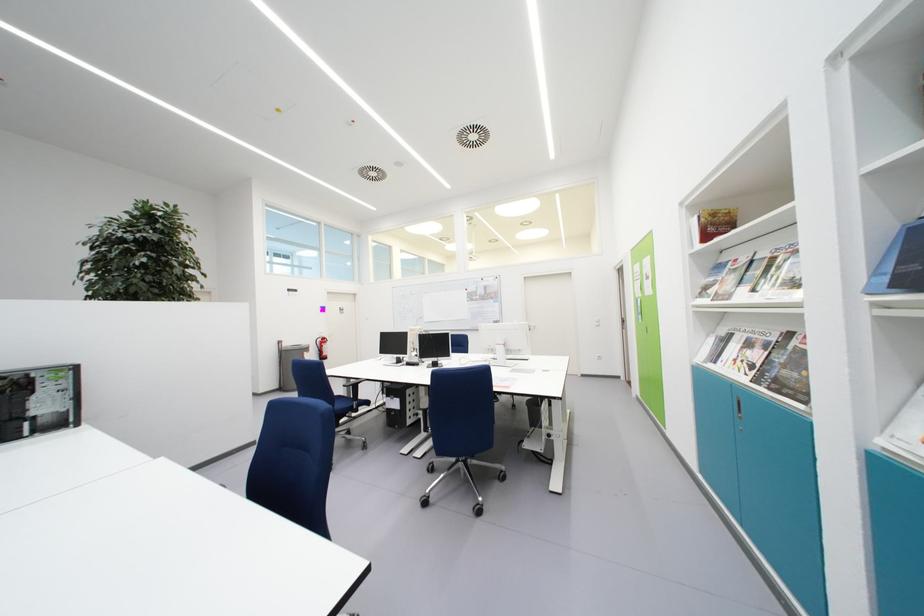
Locate an element on the screen. blue chair sitting surface is located at coordinates (343, 400).